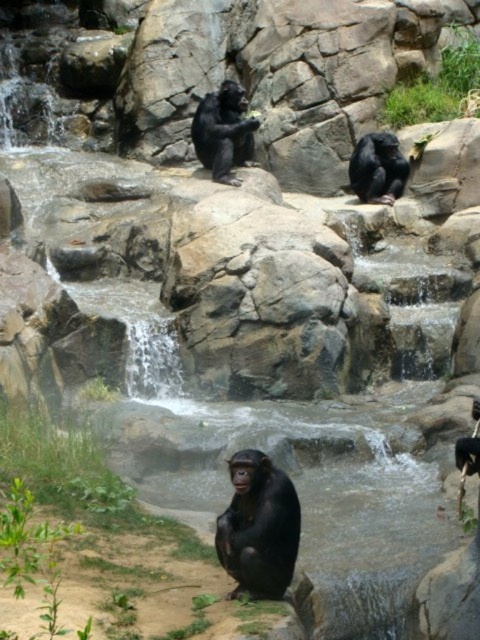
Does shiny black monkey at center appear on the left side of black matte monkey at center?

Incorrect, shiny black monkey at center is not on the left side of black matte monkey at center.

Measure the distance between shiny black monkey at center and black matte monkey at center.

A distance of 11.15 meters exists between shiny black monkey at center and black matte monkey at center.

Does point (298, 545) come behind point (220, 161)?

No.

Find the location of a particular element. The width and height of the screenshot is (480, 640). shiny black monkey at center is located at coordinates click(x=259, y=525).

Between shiny black monkey at center and shiny black monkey at upper center, which one is positioned lower?

shiny black monkey at center

Is shiny black monkey at center positioned behind shiny black monkey at upper center?

No.

Is point (251, 492) farther from camera compared to point (374, 157)?

No, (251, 492) is closer to viewer.

Where is `shiny black monkey at center`? Image resolution: width=480 pixels, height=640 pixels. shiny black monkey at center is located at coordinates (259, 525).

What do you see at coordinates (224, 131) in the screenshot? I see `black matte monkey at center` at bounding box center [224, 131].

Find the location of a particular element. Image resolution: width=480 pixels, height=640 pixels. black matte monkey at center is located at coordinates (224, 131).

This screenshot has width=480, height=640. Describe the element at coordinates (224, 131) in the screenshot. I see `black matte monkey at center` at that location.

Locate an element on the screen. Image resolution: width=480 pixels, height=640 pixels. black matte monkey at center is located at coordinates (224, 131).